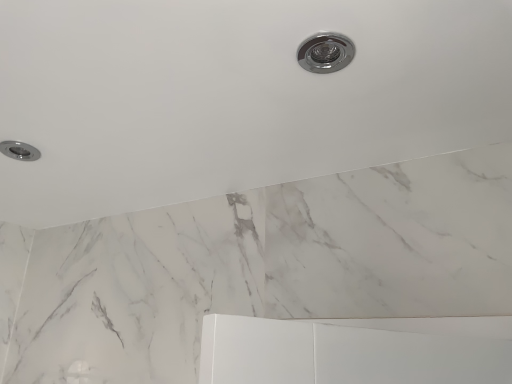
Question: From the image's perspective, would you say chrome/metallic recessed light at upper center is positioned over satin chrome light fixture at upper left?

Choices:
 (A) yes
 (B) no

Answer: (A)

Question: Can you confirm if chrome/metallic recessed light at upper center is smaller than satin chrome light fixture at upper left?

Choices:
 (A) yes
 (B) no

Answer: (A)

Question: Does chrome/metallic recessed light at upper center lie in front of satin chrome light fixture at upper left?

Choices:
 (A) no
 (B) yes

Answer: (B)

Question: Considering the relative sizes of chrome/metallic recessed light at upper center and satin chrome light fixture at upper left in the image provided, is chrome/metallic recessed light at upper center wider than satin chrome light fixture at upper left?

Choices:
 (A) no
 (B) yes

Answer: (A)

Question: Is chrome/metallic recessed light at upper center behind satin chrome light fixture at upper left?

Choices:
 (A) yes
 (B) no

Answer: (B)

Question: Can you confirm if chrome/metallic recessed light at upper center is shorter than satin chrome light fixture at upper left?

Choices:
 (A) yes
 (B) no

Answer: (A)

Question: Is satin chrome light fixture at upper left far from chrome/metallic recessed light at upper center?

Choices:
 (A) yes
 (B) no

Answer: (B)

Question: Can you confirm if satin chrome light fixture at upper left is positioned to the left of chrome/metallic recessed light at upper center?

Choices:
 (A) yes
 (B) no

Answer: (A)

Question: Is satin chrome light fixture at upper left bigger than chrome/metallic recessed light at upper center?

Choices:
 (A) yes
 (B) no

Answer: (A)

Question: Is satin chrome light fixture at upper left at the right side of chrome/metallic recessed light at upper center?

Choices:
 (A) no
 (B) yes

Answer: (A)

Question: Does satin chrome light fixture at upper left touch chrome/metallic recessed light at upper center?

Choices:
 (A) yes
 (B) no

Answer: (B)

Question: Is the depth of satin chrome light fixture at upper left less than that of chrome/metallic recessed light at upper center?

Choices:
 (A) yes
 (B) no

Answer: (B)

Question: From a real-world perspective, is chrome/metallic recessed light at upper center physically located above or below satin chrome light fixture at upper left?

Choices:
 (A) above
 (B) below

Answer: (B)